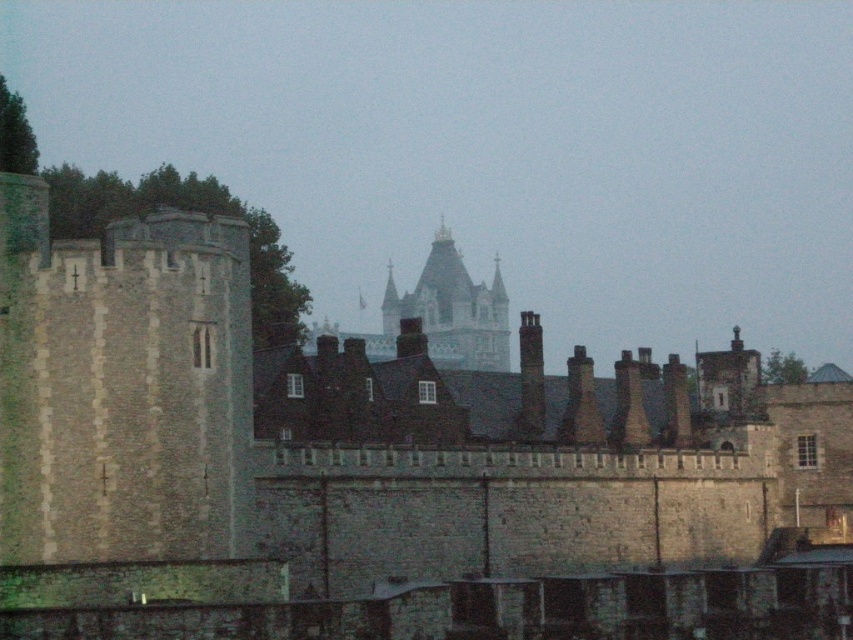
Does stone tower at left have a larger size compared to stone spire at center?

Incorrect, stone tower at left is not larger than stone spire at center.

Which is more to the left, stone tower at left or stone spire at center?

stone spire at center is more to the left.

You are a GUI agent. You are given a task and a screenshot of the screen. Output one action in this format:
    pyautogui.click(x=<x>, y=<y>)
    Task: Click on the stone tower at left
    
    Given the screenshot: What is the action you would take?
    pyautogui.click(x=380, y=468)

Image resolution: width=853 pixels, height=640 pixels. Identify the location of stone tower at left. (380, 468).